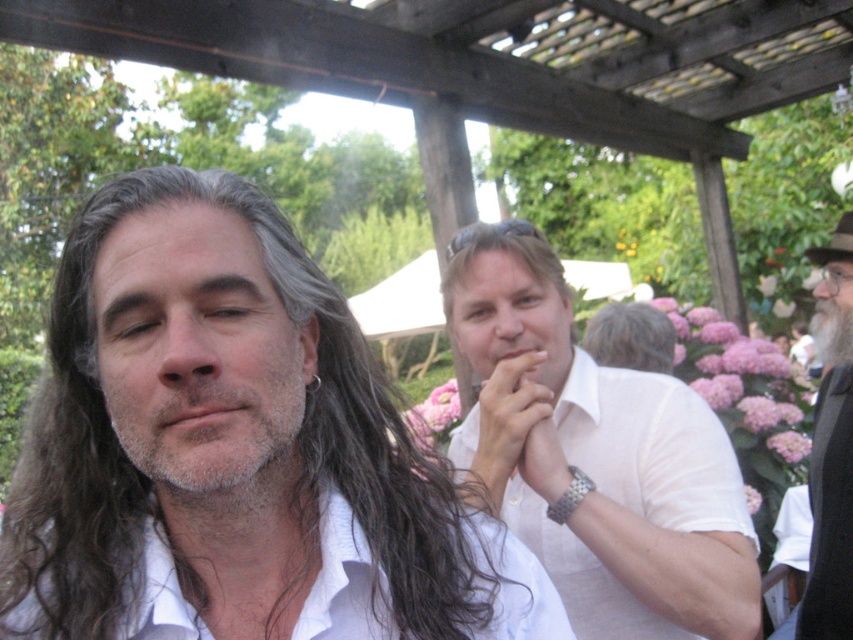
You are a photographer trying to capture a closeup of the brownwoollyhair at left and the white matte shirt at center. Based on their positions, which object is positioned higher in the frame?

The brownwoollyhair at left is above the white matte shirt at center, so it is positioned higher in the frame.

You are planning to place a small table between the graysoftbeard at center and the blondehair at center during the gathering. Given their positions and sizes, will the table fit comfortably if the table requires at least 0.5 meters of space between them?

The graysoftbeard at center is narrower than the blondehair at center. However, the exact distance between them isn

You are standing at the origin point in the image and want to reach the point at the bottom right corner. Which point, point (697, 531) or point (136, 397), is closer to your starting position?

Point (136, 397) is closer to the origin point because it has a smaller y and x coordinate compared to point (697, 531).